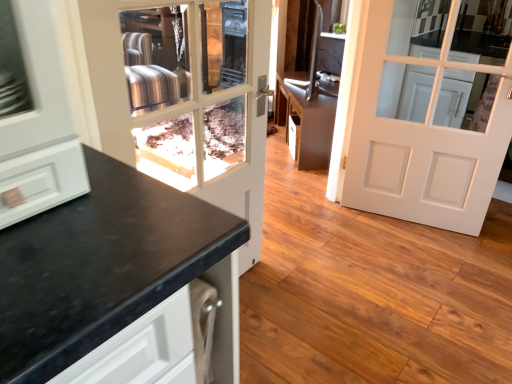
Image resolution: width=512 pixels, height=384 pixels. Identify the location of vacant area that is situated to the right of matte black door at center, marked as the second door in a right-to-left arrangement. (304, 309).